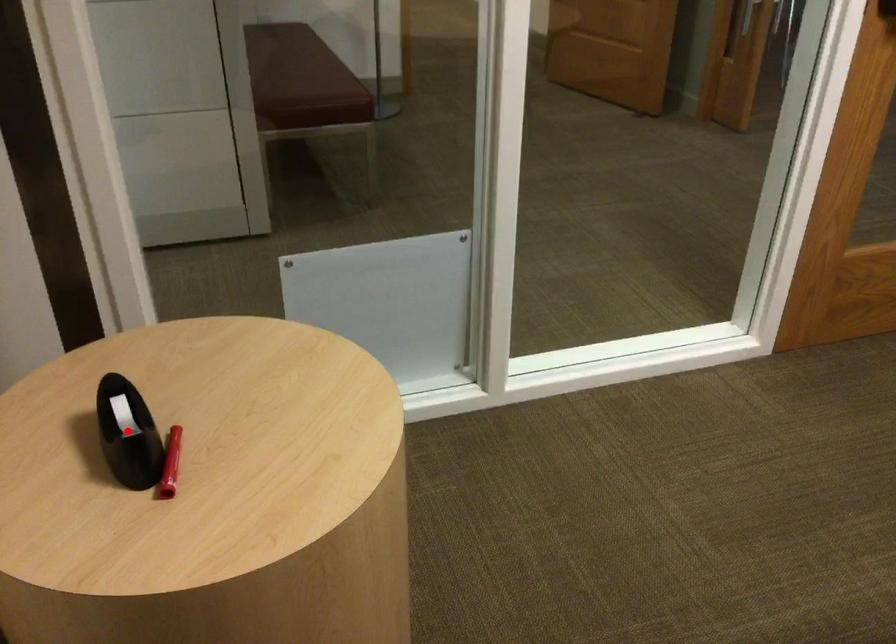
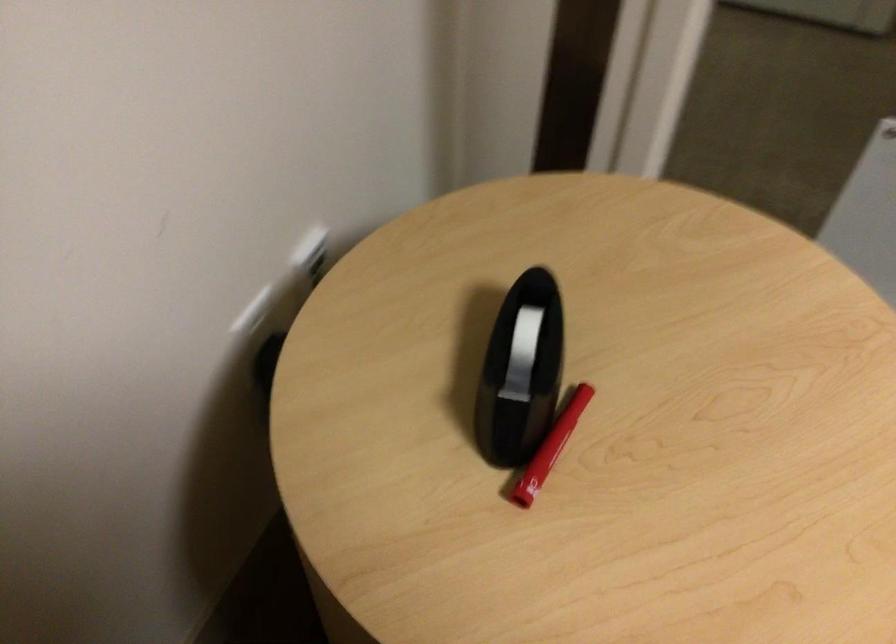
Locate, in the second image, the point that corresponds to the highlighted location in the first image.

(521, 371)